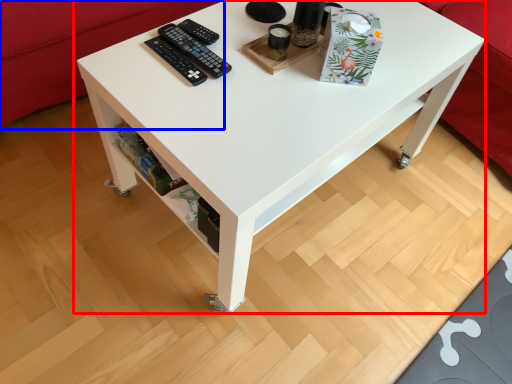
Question: Which object is further to the camera taking this photo, table (highlighted by a red box) or couch (highlighted by a blue box)?

Choices:
 (A) table
 (B) couch

Answer: (B)